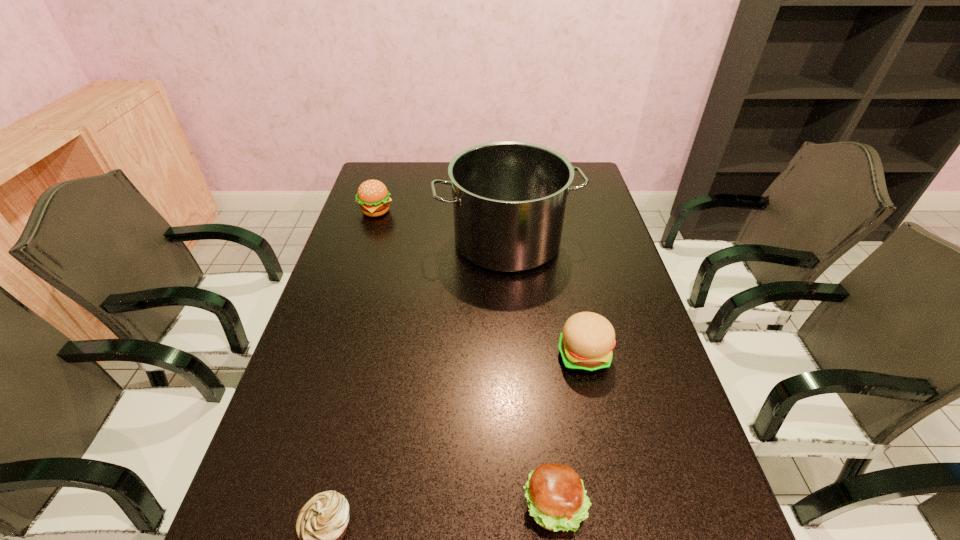
Choose which hamburger is the third nearest neighbor to the tallest object. Please provide its 2D coordinates. Your answer should be formatted as a tuple, i.e. [(x, y)], where the tuple contains the x and y coordinates of a point satisfying the conditions above.

[(557, 501)]

I want to click on free region that satisfies the following two spatial constraints: 1. on the front side of the tallest object; 2. on the left side of the third farthest object, so click(x=516, y=356).